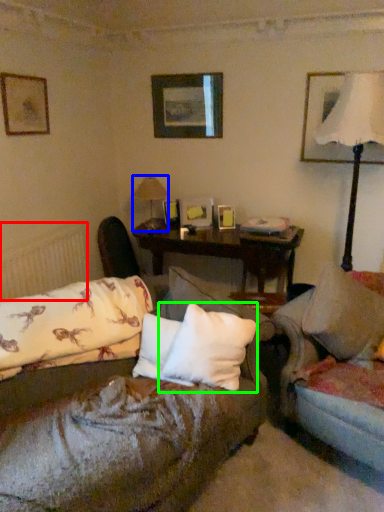
Question: Estimate the real-world distances between objects in this image. Which object is farther from radiator (highlighted by a red box), table lamp (highlighted by a blue box) or pillow (highlighted by a green box)?

Choices:
 (A) table lamp
 (B) pillow

Answer: (B)